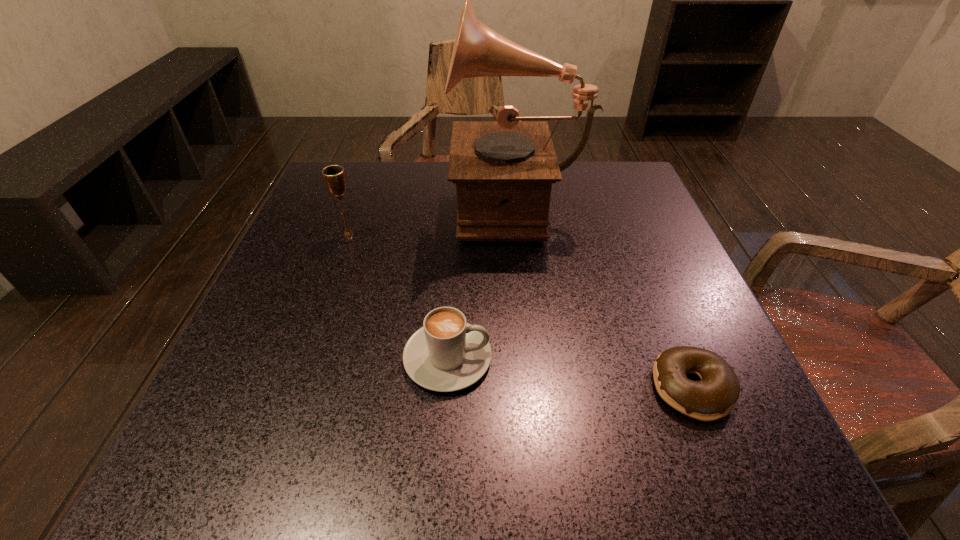
In order to click on free space located to the right of the second shortest object in this screenshot , I will do `click(718, 358)`.

Locate an element on the screen. This screenshot has width=960, height=540. blank space located on the left of the doughnut is located at coordinates [x=545, y=388].

Identify the location of object at the far edge. The height and width of the screenshot is (540, 960). (503, 170).

This screenshot has width=960, height=540. Identify the location of object at the near edge. (714, 397).

The image size is (960, 540). I want to click on object present at the left edge, so click(x=334, y=176).

This screenshot has width=960, height=540. What are the coordinates of `object present at the right edge` in the screenshot? It's located at (714, 397).

The image size is (960, 540). In order to click on object positioned at the near right corner in this screenshot , I will do `click(714, 397)`.

The height and width of the screenshot is (540, 960). I want to click on vacant area at the far edge, so click(387, 187).

In order to click on free space at the near edge of the desktop in this screenshot , I will do `click(506, 467)`.

This screenshot has height=540, width=960. Identify the location of vacant region at the left edge of the desktop. [260, 349].